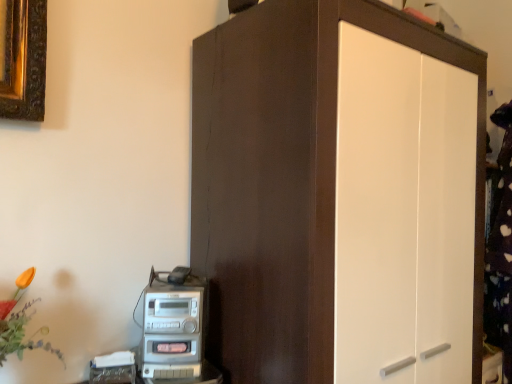
Question: From the image's perspective, is matte brown cupboard at center above or below silver metallic stereo at lower left?

Choices:
 (A) below
 (B) above

Answer: (B)

Question: In the image, is matte brown cupboard at center on the left side or the right side of silver metallic stereo at lower left?

Choices:
 (A) left
 (B) right

Answer: (B)

Question: From their relative heights in the image, would you say matte brown cupboard at center is taller or shorter than silver metallic stereo at lower left?

Choices:
 (A) tall
 (B) short

Answer: (A)

Question: From a real-world perspective, relative to matte brown cupboard at center, is silver metallic stereo at lower left vertically above or below?

Choices:
 (A) below
 (B) above

Answer: (A)

Question: Would you say silver metallic stereo at lower left is to the left or to the right of matte brown cupboard at center in the picture?

Choices:
 (A) right
 (B) left

Answer: (B)

Question: Is silver metallic stereo at lower left in front of or behind matte brown cupboard at center in the image?

Choices:
 (A) front
 (B) behind

Answer: (B)

Question: Is point (193, 324) closer or farther from the camera than point (274, 92)?

Choices:
 (A) closer
 (B) farther

Answer: (B)